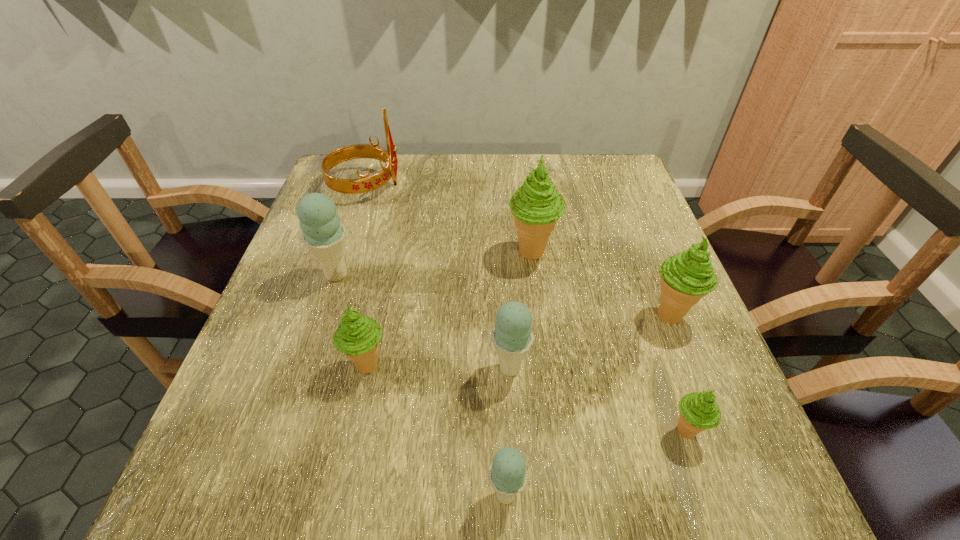
The image size is (960, 540). Find the location of `the sixth ice cream from right to left`. the sixth ice cream from right to left is located at coordinates (358, 336).

Identify the location of the second nearest object. The height and width of the screenshot is (540, 960). (699, 411).

Find the location of a particular element. This screenshot has height=540, width=960. the sixth farthest ice cream is located at coordinates (699, 411).

The width and height of the screenshot is (960, 540). I want to click on the nearest blue ice cream, so click(x=508, y=475).

Locate an element on the screen. the nearest object is located at coordinates (508, 475).

Identify the location of vacant space situated on the front of the tallest ice cream. The height and width of the screenshot is (540, 960). (542, 326).

Locate an element on the screen. This screenshot has width=960, height=540. free spot located on the front-facing side of the tiara is located at coordinates (477, 185).

Find the location of a particular element. The image size is (960, 540). free space located on the front of the biggest blue ice cream is located at coordinates point(286,429).

Find the location of a particular element. This screenshot has width=960, height=540. vacant area located on the front of the third farthest ice cream is located at coordinates (688, 360).

Locate an element on the screen. The height and width of the screenshot is (540, 960). free region located 0.110m on the left of the second biggest blue ice cream is located at coordinates (430, 368).